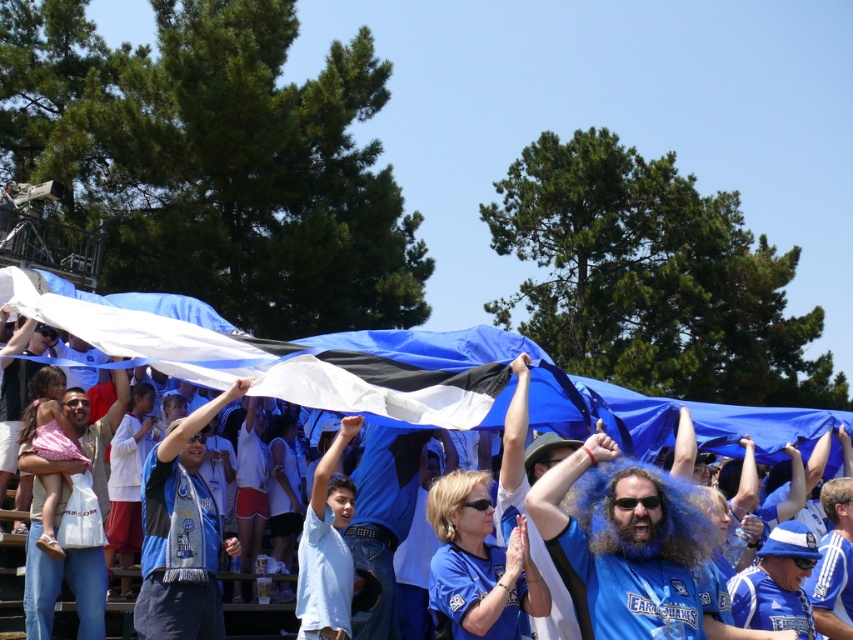
You are organizing a parade and need to decide whether the blue fabric flag at center can be displayed alongside the blue fabric wig at center without overlapping. Based on their widths, can they be placed side by side in the available space?

The blue fabric flag at center might be wider than blue fabric wig at center, so there is a possibility they could overlap if placed side by side. Check the exact width measurements to confirm.

You are standing at the center of the crowd holding a camera. You want to take a photo of the large, colorful banner with horizontal stripes in white, black, and blue. The banner is held by people wearing blue shirts. Where should you aim your camera to capture the point at coordinate point (285, 362) on the blue fabric flag at center?

The point at coordinate point (285, 362) is located on the blue fabric flag at center, so aim your camera at the blue fabric flag at center to capture that point.